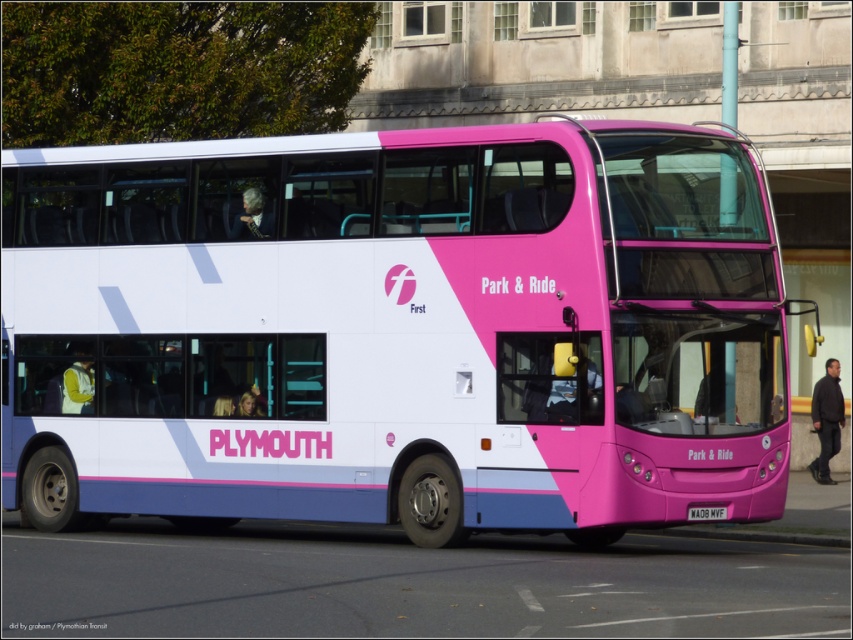
Does pink glossy bus at center appear on the left side of white plastic license plate at lower center?

Yes, pink glossy bus at center is to the left of white plastic license plate at lower center.

Which is more to the right, pink glossy bus at center or white plastic license plate at lower center?

Positioned to the right is white plastic license plate at lower center.

Does point (126, 381) come behind point (698, 515)?

Yes, it is behind point (698, 515).

Identify the location of pink glossy bus at center. This screenshot has height=640, width=853. (396, 330).